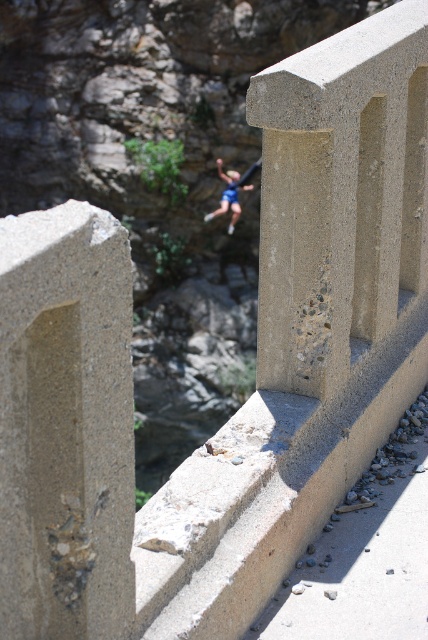
Does gray textured concrete at left have a greater width compared to beige concrete pillar at center?

No.

Looking at this image, between gray textured concrete at left and beige concrete pillar at center, which one appears on the left side from the viewer's perspective?

gray textured concrete at left is more to the left.

Is point (100, 218) farther from viewer compared to point (332, 44)?

No.

Locate an element on the screen. The height and width of the screenshot is (640, 428). gray textured concrete at left is located at coordinates (65, 426).

Is gray textured concrete at left smaller than blue fabric rock climber at center?

Correct, gray textured concrete at left occupies less space than blue fabric rock climber at center.

Can you confirm if gray textured concrete at left is positioned to the right of blue fabric rock climber at center?

No, gray textured concrete at left is not to the right of blue fabric rock climber at center.

The width and height of the screenshot is (428, 640). I want to click on gray textured concrete at left, so click(65, 426).

The width and height of the screenshot is (428, 640). What do you see at coordinates (339, 196) in the screenshot?
I see `beige concrete pillar at center` at bounding box center [339, 196].

Where is `beige concrete pillar at center`? beige concrete pillar at center is located at coordinates (339, 196).